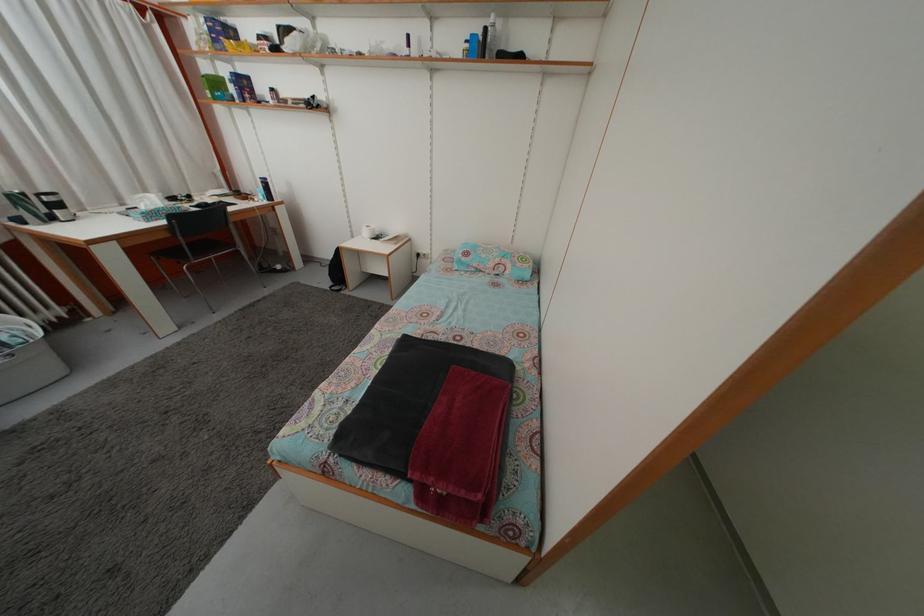
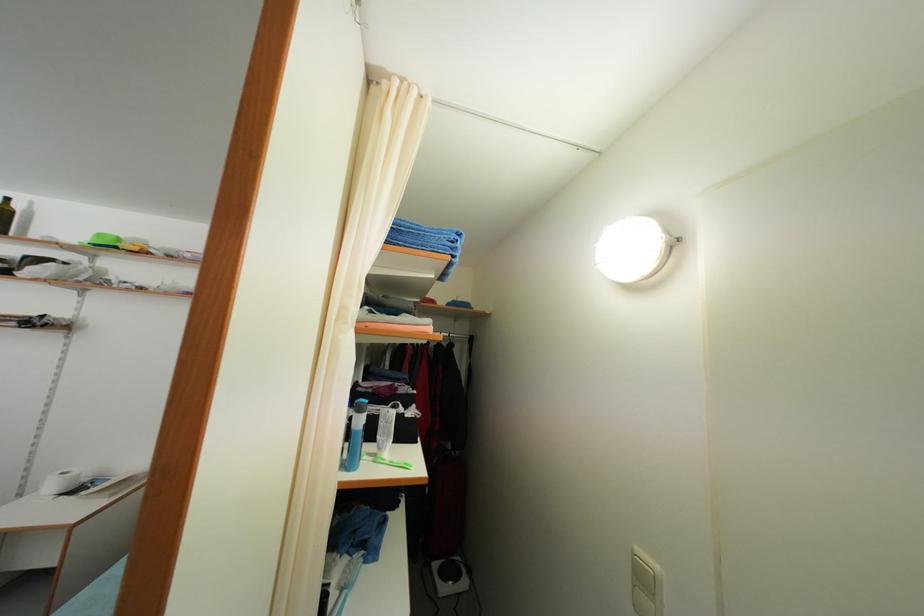
Question: I am providing you with two images of the same scene from different viewpoints. After the viewpoint changes to image2, which objects are now occluded?

Choices:
 (A) white light switch
 (B) white bottle
 (C) white spray bottle
 (D) white wifi router

Answer: (C)